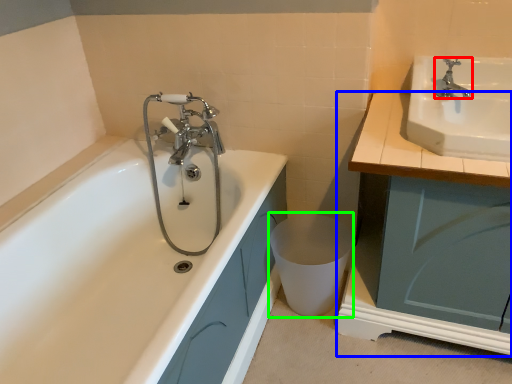
Question: Based on their relative distances, which object is farther from tap (highlighted by a red box)? Choose from cabinetry (highlighted by a blue box) and toilet bowl (highlighted by a green box).

Choices:
 (A) cabinetry
 (B) toilet bowl

Answer: (B)